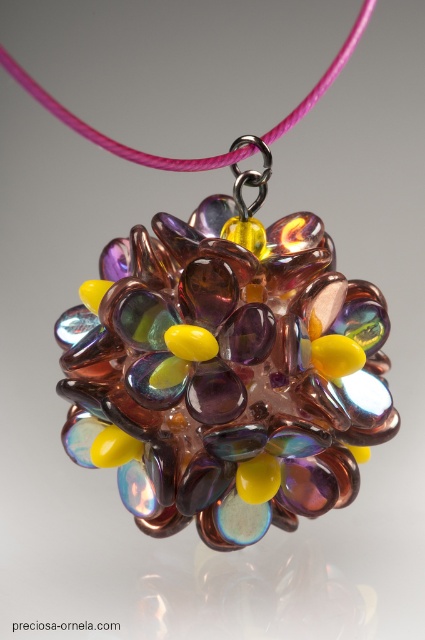
You are a jewelry designer examining the pendant necklace. You notice the pink cord at upper center and the translucent yellow glass bead at center. Which object is positioned higher in the necklace?

The pink cord at upper center is positioned higher than the translucent yellow glass bead at center.